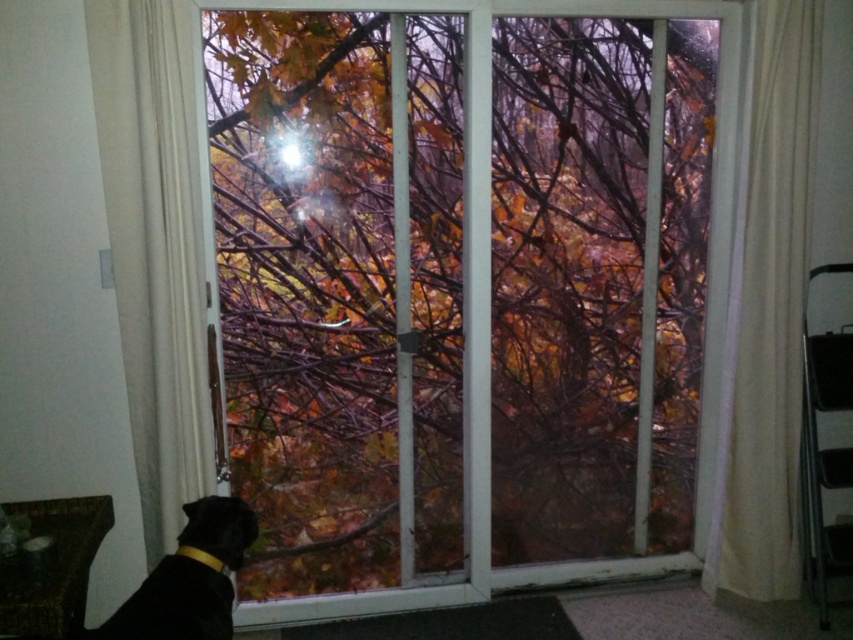
You are holding a 2.5 meter long fishing rod and want to bring it inside through the transparent glass window at center. Can you fit it through the window without bending it?

The transparent glass window at center is 2.51 meters away from the viewer. Since the fishing rod is 2.5 meters long, it can fit through the window without bending as the distance is slightly longer than the rod.

You are standing in the room and looking through the sliding glass door. There are two points marked on the door, one at point (102, 138) and the other at point (227, 634). From your perspective inside the room, which point is closer to you?

Point (102, 138) is behind point (227, 634), so from your perspective inside the room, point (227, 634) is closer to you.

You are a guest standing inside the house and looking through the sliding glass door. You see the white sheer curtain at left and the black fur dog at lower left. Which object is closer to the glass door?

The black fur dog at lower left is closer to the glass door because the white sheer curtain at left is above it, indicating the dog is in front.